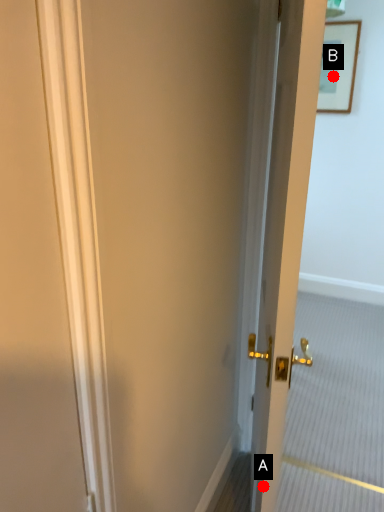
Question: Two points are circled on the image, labeled by A and B beside each circle. Which of the following is the farthest from the observer?

Choices:
 (A) A is further
 (B) B is further

Answer: (B)